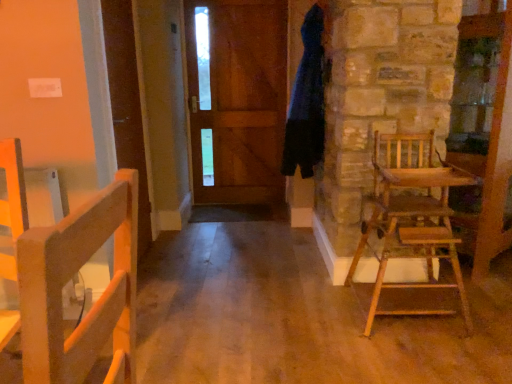
Locate an element on the screen. free spot below wooden high chair at right (from a real-world perspective) is located at coordinates (410, 311).